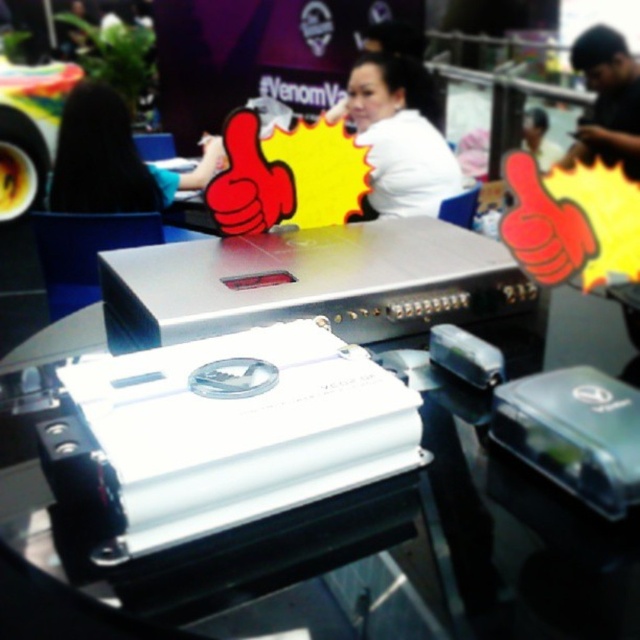
Question: Is white matte shirt at upper center closer to camera compared to blonde hair at upper left?

Choices:
 (A) yes
 (B) no

Answer: (B)

Question: Does blonde hair at upper left have a lesser width compared to black matte shirt at upper right?

Choices:
 (A) no
 (B) yes

Answer: (A)

Question: Which of the following is the closest to the observer?

Choices:
 (A) white matte shirt at upper center
 (B) blonde hair at upper left
 (C) black matte shirt at upper right

Answer: (B)

Question: Considering the relative positions of blonde hair at upper left and black matte shirt at upper right in the image provided, where is blonde hair at upper left located with respect to black matte shirt at upper right?

Choices:
 (A) below
 (B) above

Answer: (A)

Question: Estimate the real-world distances between objects in this image. Which object is closer to the white matte shirt at upper center?

Choices:
 (A) blonde hair at upper left
 (B) black matte shirt at upper right

Answer: (B)

Question: Which point appears closest to the camera in this image?

Choices:
 (A) (385, 125)
 (B) (188, 188)
 (C) (602, 147)

Answer: (B)